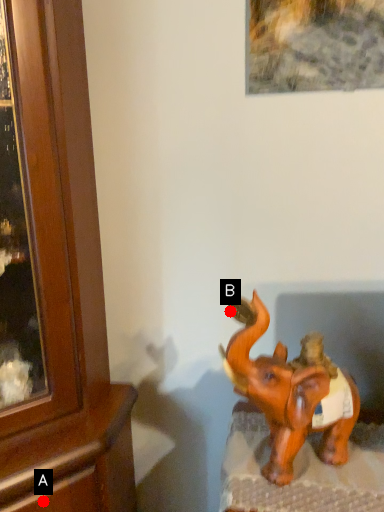
Question: Two points are circled on the image, labeled by A and B beside each circle. Among these points, which one is farthest from the camera?

Choices:
 (A) A is further
 (B) B is further

Answer: (A)